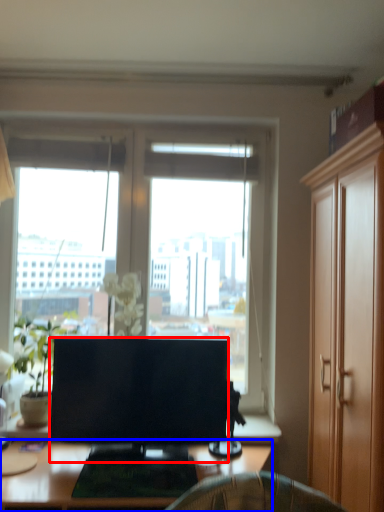
Question: Which object appears farthest to the camera in this image, television (highlighted by a red box) or desk (highlighted by a blue box)?

Choices:
 (A) television
 (B) desk

Answer: (A)